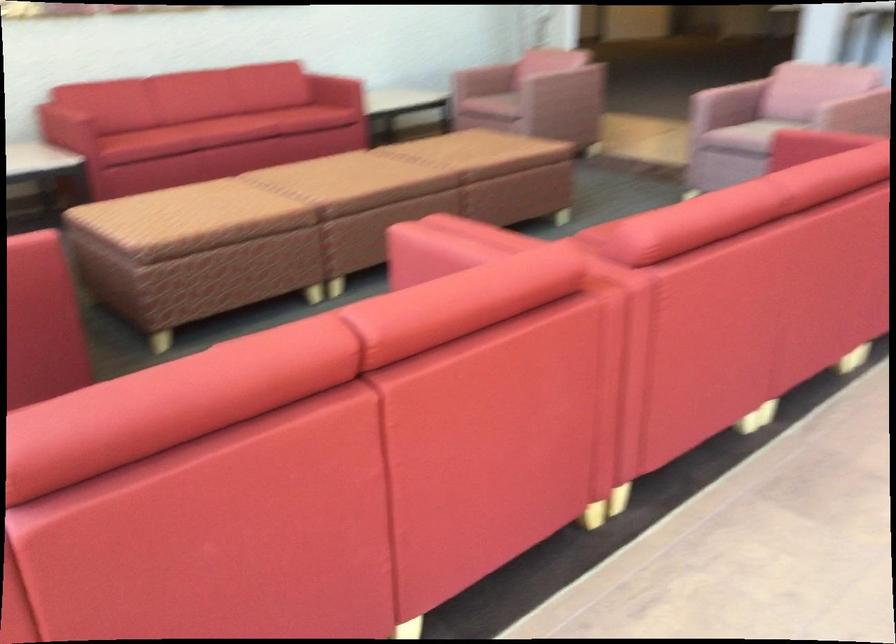
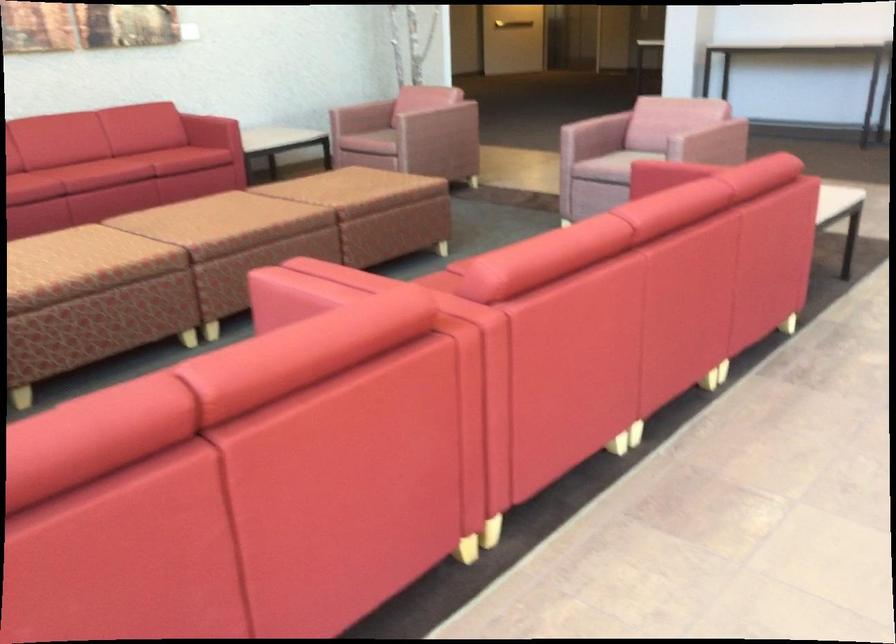
Question: Which direction would the cameraman need to move to produce the second image? Reply with the corresponding letter.

Choices:
 (A) Left
 (B) Right
 (C) Forward
 (D) Backward

Answer: (B)